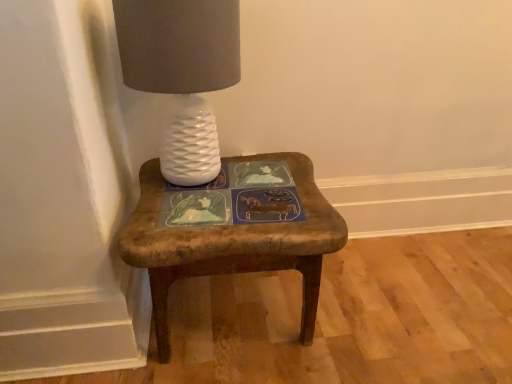
Question: In terms of size, does wooden stool at center appear bigger or smaller than white textured lamp at upper left?

Choices:
 (A) big
 (B) small

Answer: (A)

Question: From a real-world perspective, is wooden stool at center physically located above or below white textured lamp at upper left?

Choices:
 (A) above
 (B) below

Answer: (B)

Question: Is wooden stool at center in front of or behind white textured lamp at upper left in the image?

Choices:
 (A) behind
 (B) front

Answer: (A)

Question: Relative to wooden stool at center, is white textured lamp at upper left in front or behind?

Choices:
 (A) behind
 (B) front

Answer: (B)

Question: Is white textured lamp at upper left spatially inside wooden stool at center, or outside of it?

Choices:
 (A) outside
 (B) inside

Answer: (A)

Question: Looking at their shapes, would you say white textured lamp at upper left is wider or thinner than wooden stool at center?

Choices:
 (A) wide
 (B) thin

Answer: (B)

Question: Considering the positions of white textured lamp at upper left and wooden stool at center in the image, is white textured lamp at upper left taller or shorter than wooden stool at center?

Choices:
 (A) tall
 (B) short

Answer: (A)